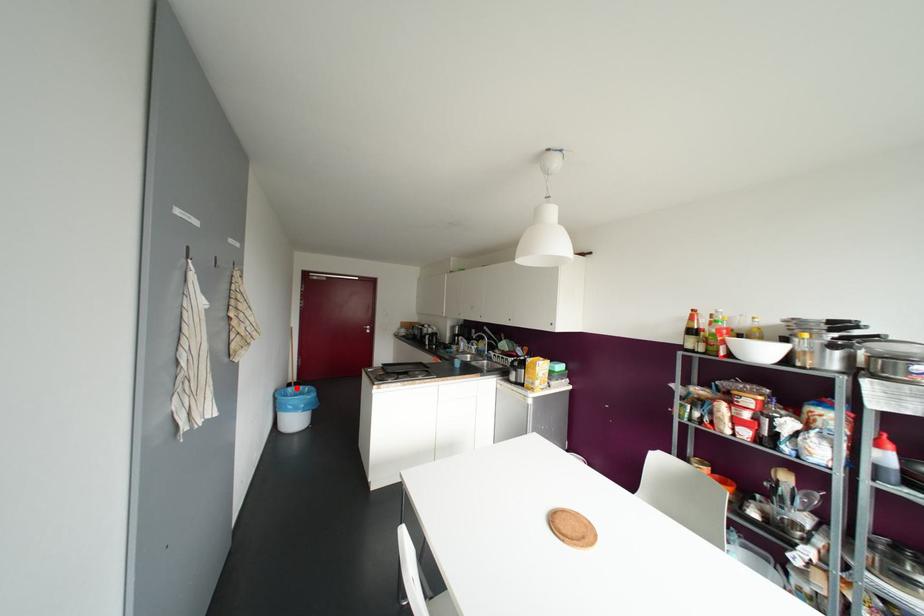
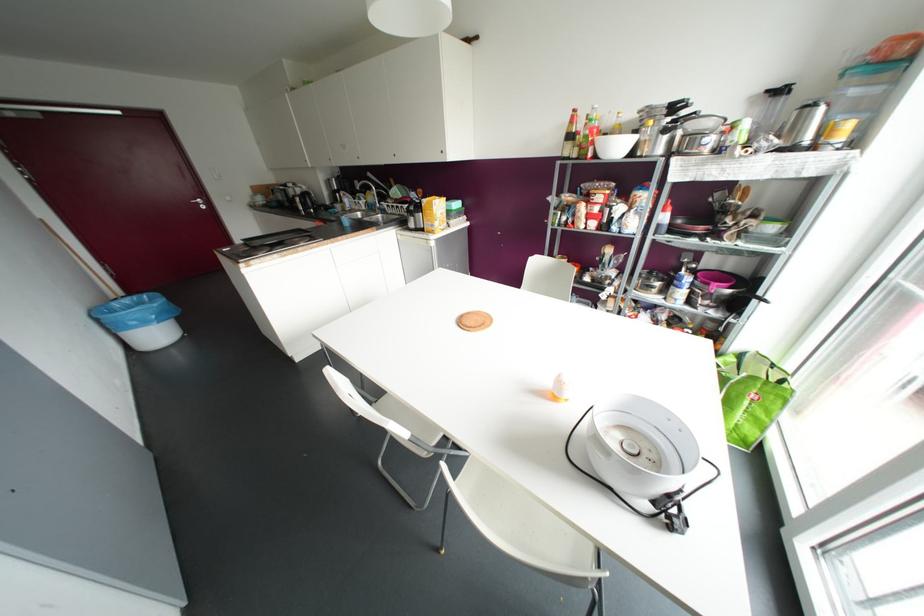
Question: A red point is marked in image1. In image2, is the corresponding 3D point closer to the camera or farther? Reply with the corresponding letter.

Choices:
 (A) The corresponding 3D point is closer.
 (B) The corresponding 3D point is farther.

Answer: (A)